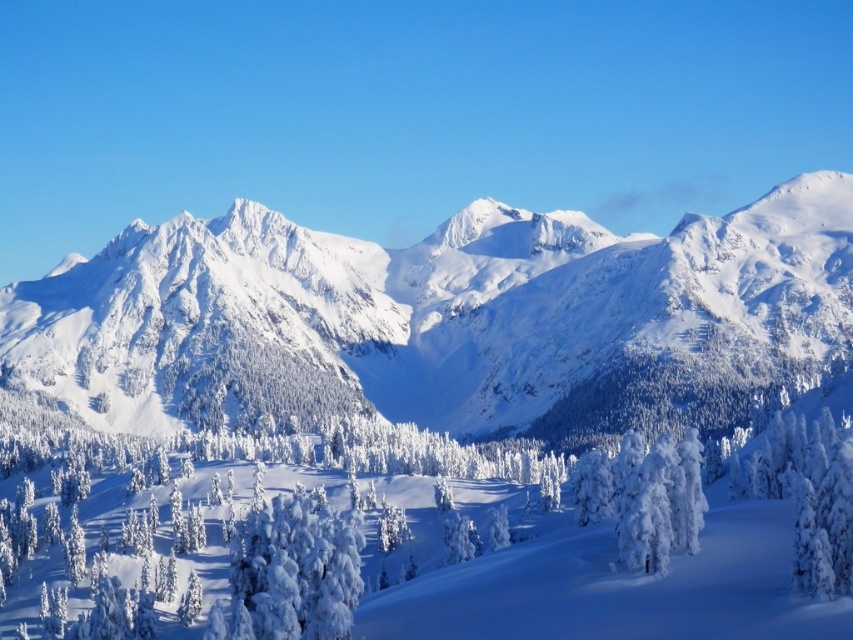
Question: Does white snow-covered mountain range at center have a larger size compared to white frosty tree at center?

Choices:
 (A) yes
 (B) no

Answer: (A)

Question: Which point is closer to the camera?

Choices:
 (A) (764, 264)
 (B) (355, 509)

Answer: (B)

Question: Does white snow-covered mountain range at center appear on the left side of white frosty tree at center?

Choices:
 (A) yes
 (B) no

Answer: (B)

Question: Does white snow-covered mountain range at center have a greater width compared to white frosty tree at center?

Choices:
 (A) no
 (B) yes

Answer: (B)